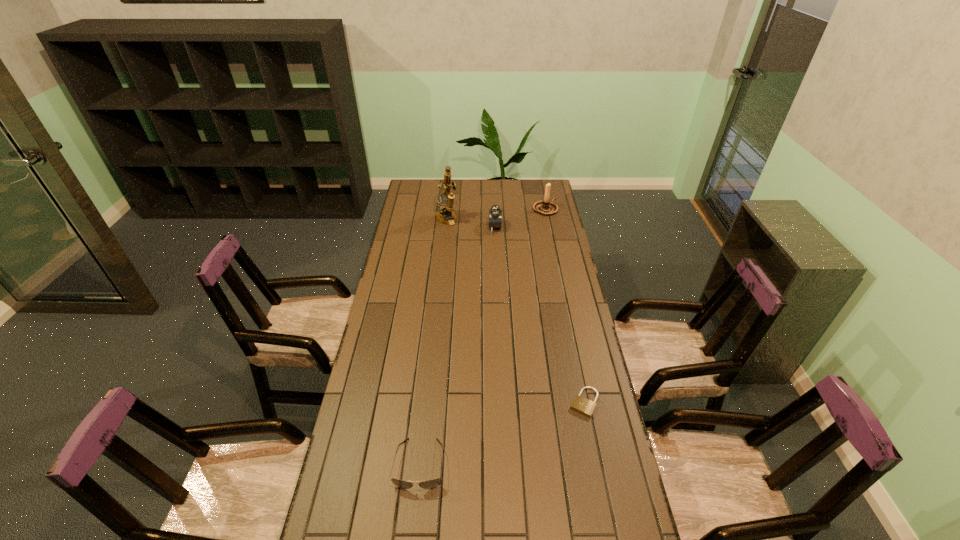
Identify the location of vacant region at the right edge. tap(547, 237).

In the image, there is a desktop. Where is `vacant space at the far left corner`? vacant space at the far left corner is located at coordinates (408, 200).

Locate an element on the screen. blank space at the far right corner is located at coordinates (525, 188).

At what (x,y) coordinates should I click in order to perform the action: click on vacant point located between the sunglasses and the second tallest object. Please return your answer as a coordinate pair (x, y). Image resolution: width=960 pixels, height=540 pixels. Looking at the image, I should click on (483, 336).

I want to click on empty space that is in between the candle holder and the sunglasses, so click(483, 336).

Locate an element on the screen. Image resolution: width=960 pixels, height=540 pixels. vacant region between the fourth tallest object and the candle holder is located at coordinates (483, 336).

Locate an element on the screen. Image resolution: width=960 pixels, height=540 pixels. vacant area between the third tallest object and the microscope is located at coordinates (470, 223).

You are a GUI agent. You are given a task and a screenshot of the screen. Output one action in this format:
    pyautogui.click(x=<x>, y=<y>)
    Task: Click on the vacant space in between the fourth shortest object and the padlock
    
    Given the screenshot: What is the action you would take?
    pyautogui.click(x=564, y=306)

Identify the location of free spot between the second nearest object and the tallest object. (516, 311).

The height and width of the screenshot is (540, 960). Identify the location of unoccupied area between the microscope and the shortest object. (516, 311).